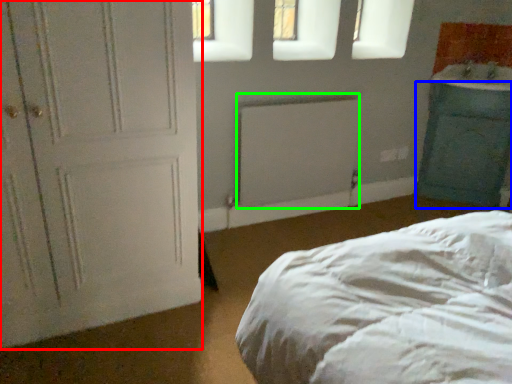
Question: Estimate the real-world distances between objects in this image. Which object is closer to door (highlighted by a red box), cabinetry (highlighted by a blue box) or radiator (highlighted by a green box)?

Choices:
 (A) cabinetry
 (B) radiator

Answer: (B)